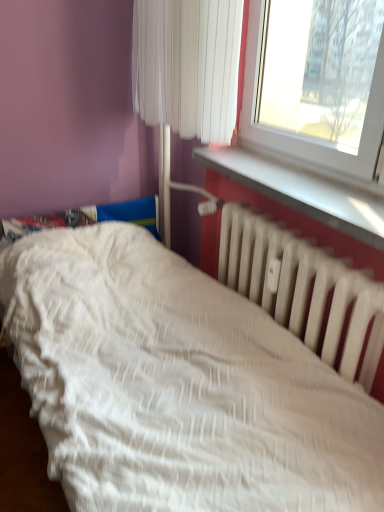
Question: Considering the relative sizes of white fabric curtain at upper center and white textured bed at lower left in the image provided, is white fabric curtain at upper center thinner than white textured bed at lower left?

Choices:
 (A) yes
 (B) no

Answer: (A)

Question: Is white fabric curtain at upper center facing away from white textured bed at lower left?

Choices:
 (A) yes
 (B) no

Answer: (B)

Question: From a real-world perspective, does white fabric curtain at upper center stand above white textured bed at lower left?

Choices:
 (A) no
 (B) yes

Answer: (B)

Question: Can you confirm if white fabric curtain at upper center is taller than white textured bed at lower left?

Choices:
 (A) no
 (B) yes

Answer: (A)

Question: Is there a large distance between white fabric curtain at upper center and white textured bed at lower left?

Choices:
 (A) yes
 (B) no

Answer: (B)

Question: From a real-world perspective, does white fabric curtain at upper center sit lower than white textured bed at lower left?

Choices:
 (A) yes
 (B) no

Answer: (B)

Question: From a real-world perspective, does white textured bed at lower left stand above white matte radiator at lower right?

Choices:
 (A) yes
 (B) no

Answer: (B)

Question: Considering the relative sizes of white textured bed at lower left and white matte radiator at lower right in the image provided, is white textured bed at lower left wider than white matte radiator at lower right?

Choices:
 (A) no
 (B) yes

Answer: (B)

Question: Can you confirm if white textured bed at lower left is positioned to the left of white matte radiator at lower right?

Choices:
 (A) yes
 (B) no

Answer: (A)

Question: From the image's perspective, is white textured bed at lower left on white matte radiator at lower right?

Choices:
 (A) yes
 (B) no

Answer: (B)

Question: Is white textured bed at lower left thinner than white matte radiator at lower right?

Choices:
 (A) no
 (B) yes

Answer: (A)

Question: Is white textured bed at lower left placed right next to white matte radiator at lower right?

Choices:
 (A) no
 (B) yes

Answer: (A)

Question: Does white plastic window sill at upper right appear on the left side of white matte radiator at lower right?

Choices:
 (A) yes
 (B) no

Answer: (B)